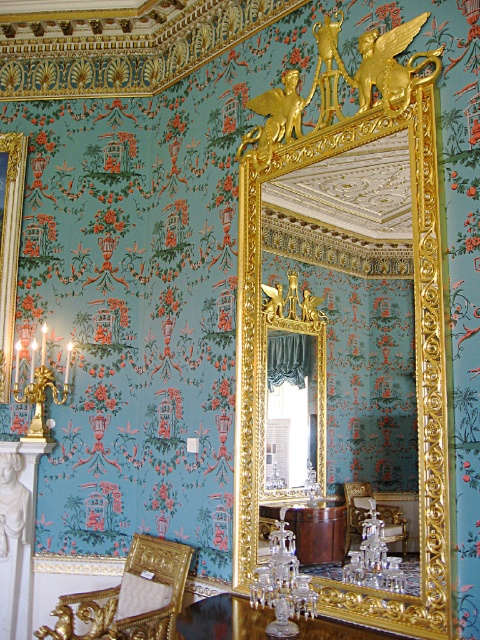
Question: Is goldmaterial/texturemirror at upper center smaller than brown polished wood table at center?

Choices:
 (A) no
 (B) yes

Answer: (A)

Question: Which of the following is the farthest from the observer?

Choices:
 (A) polished wood table at center
 (B) goldmaterial/texturemirror at upper center
 (C) gold leaf chair at center
 (D) gold upholstered chair at lower left

Answer: (D)

Question: Is goldmaterial/texturemirror at upper center smaller than brown polished wood table at center?

Choices:
 (A) no
 (B) yes

Answer: (A)

Question: Which of these objects is positioned closest to the polished wood table at center?

Choices:
 (A) gold upholstered chair at lower left
 (B) gold leaf chair at center

Answer: (B)

Question: Does gold metallic chandelier at left have a lesser width compared to gold leaf chair at center?

Choices:
 (A) yes
 (B) no

Answer: (B)

Question: Which object is farther from the camera taking this photo?

Choices:
 (A) gold upholstered chair at lower left
 (B) gold metallic chandelier at left
 (C) polished wood table at center
 (D) gold leaf chair at center

Answer: (B)